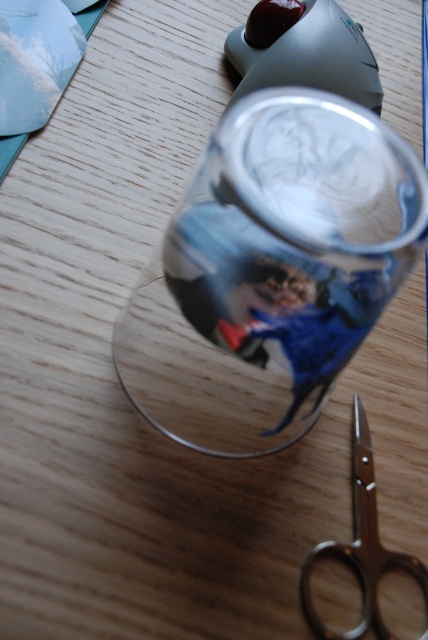
Question: Which object is closer to the camera taking this photo?

Choices:
 (A) transparent glass cup at center
 (B) polished silver scissors at lower right

Answer: (A)

Question: Is transparent glass cup at center bigger than polished silver scissors at lower right?

Choices:
 (A) yes
 (B) no

Answer: (A)

Question: Is transparent glass cup at center wider than polished silver scissors at lower right?

Choices:
 (A) yes
 (B) no

Answer: (A)

Question: Is transparent glass cup at center closer to camera compared to polished silver scissors at lower right?

Choices:
 (A) yes
 (B) no

Answer: (A)

Question: Which point is closer to the camera?

Choices:
 (A) polished silver scissors at lower right
 (B) transparent glass cup at center

Answer: (B)